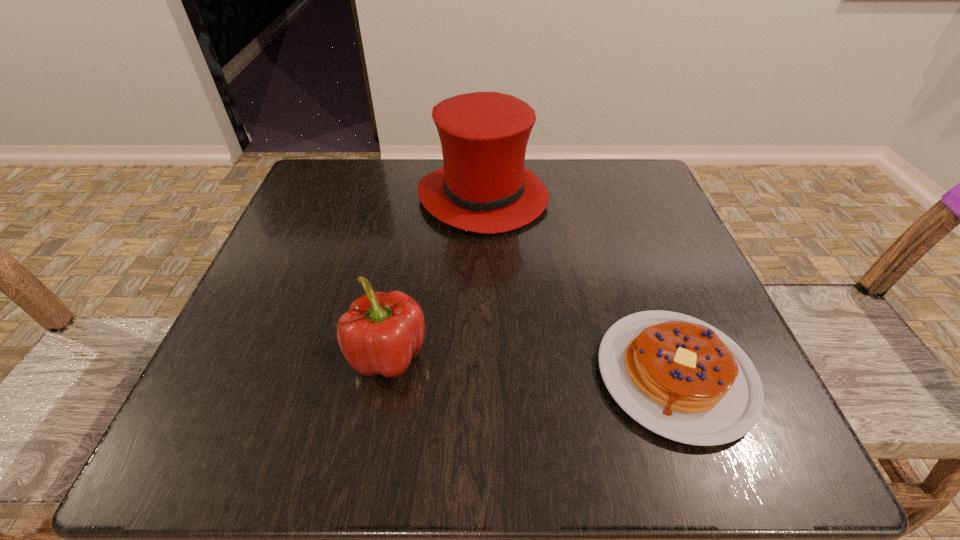
I want to click on object that is the closest one to the farthest object, so click(x=678, y=376).

Locate an element on the screen. free spot that satisfies the following two spatial constraints: 1. on the back side of the hat; 2. on the left side of the second shortest object is located at coordinates (416, 197).

Identify the location of vacant region that satisfies the following two spatial constraints: 1. on the back side of the hat; 2. on the right side of the second tallest object. click(x=416, y=197).

Where is `blank space that satisfies the following two spatial constraints: 1. on the front side of the shortest object; 2. on the left side of the pepper`? blank space that satisfies the following two spatial constraints: 1. on the front side of the shortest object; 2. on the left side of the pepper is located at coordinates (385, 375).